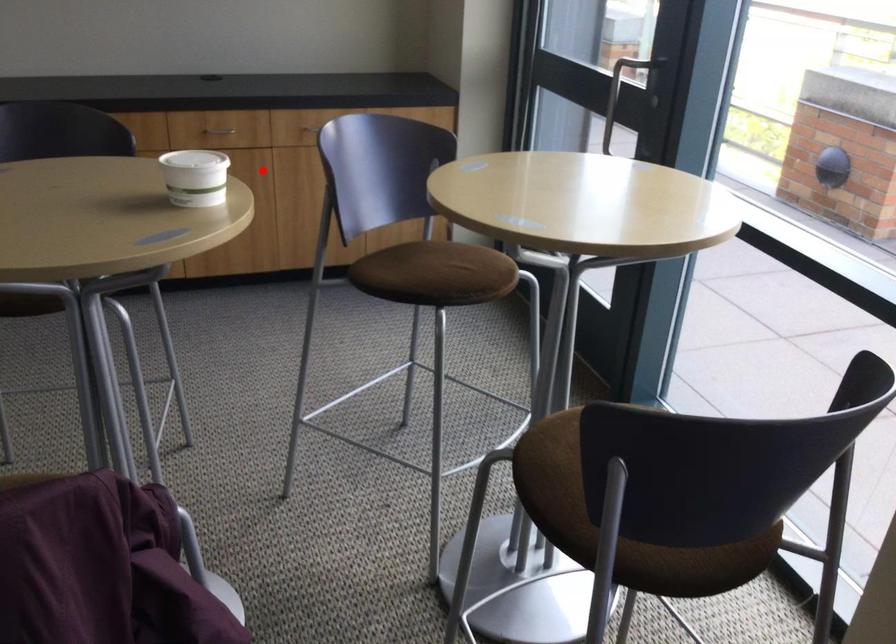
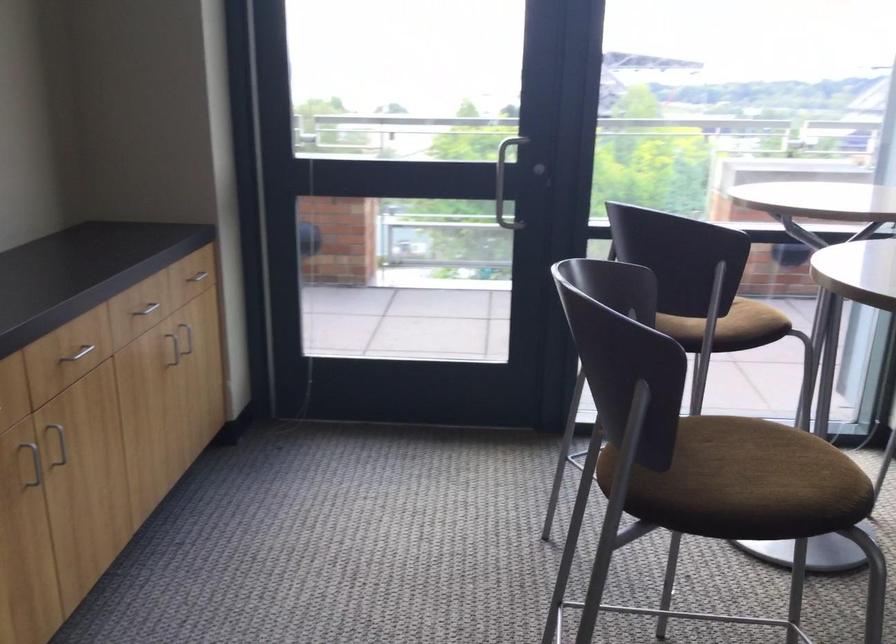
Where in the second image is the point corresponding to the highlighted location from the first image?

(57, 442)